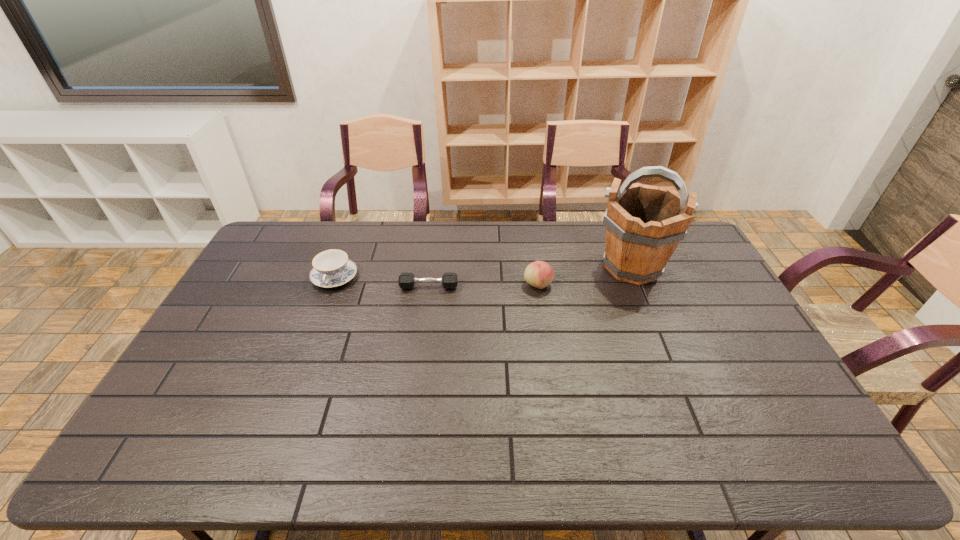
The width and height of the screenshot is (960, 540). Identify the location of object that is positioned at the far edge. (644, 224).

Identify the location of object at the right edge. (644, 224).

You are a GUI agent. You are given a task and a screenshot of the screen. Output one action in this format:
    pyautogui.click(x=<x>, y=<y>)
    Task: Click on the object that is at the far right corner
    The height and width of the screenshot is (540, 960).
    Given the screenshot: What is the action you would take?
    pyautogui.click(x=644, y=224)

In order to click on free space at the far edge of the desktop in this screenshot , I will do `click(493, 232)`.

In the image, there is a desktop. At what (x,y) coordinates should I click in order to perform the action: click on vacant space at the near edge. Please return your answer as a coordinate pair (x, y). The height and width of the screenshot is (540, 960). Looking at the image, I should click on (752, 460).

Locate an element on the screen. The height and width of the screenshot is (540, 960). vacant space at the left edge is located at coordinates (191, 425).

Identify the location of free location at the far left corner of the desktop. Image resolution: width=960 pixels, height=540 pixels. (296, 234).

Find the location of a particular element. This screenshot has height=540, width=960. free spot between the dumbbell and the leftmost object is located at coordinates (382, 282).

This screenshot has width=960, height=540. Identify the location of unoccupied area between the peach and the bucket. (585, 276).

Identify the location of free space that is in between the tallest object and the leftmost object. (483, 272).